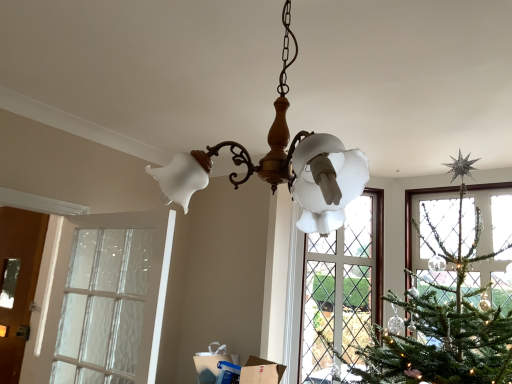
Question: Is matte white glass chandelier at center beside brown wooden door at left?

Choices:
 (A) no
 (B) yes

Answer: (A)

Question: Is the depth of matte white glass chandelier at center greater than that of brown wooden door at left?

Choices:
 (A) yes
 (B) no

Answer: (B)

Question: Considering the relative positions of matte white glass chandelier at center and brown wooden door at left in the image provided, is matte white glass chandelier at center to the left of brown wooden door at left from the viewer's perspective?

Choices:
 (A) yes
 (B) no

Answer: (B)

Question: From the image's perspective, would you say matte white glass chandelier at center is shown under brown wooden door at left?

Choices:
 (A) no
 (B) yes

Answer: (A)

Question: From the image's perspective, does matte white glass chandelier at center appear higher than brown wooden door at left?

Choices:
 (A) yes
 (B) no

Answer: (A)

Question: From a real-world perspective, is matte white glass chandelier at center physically above brown wooden door at left?

Choices:
 (A) yes
 (B) no

Answer: (A)

Question: Does clear glass door at left lie in front of brown wooden door at left?

Choices:
 (A) no
 (B) yes

Answer: (B)

Question: Is brown wooden door at left at the back of clear glass door at left?

Choices:
 (A) yes
 (B) no

Answer: (B)

Question: Does clear glass door at left have a lesser height compared to brown wooden door at left?

Choices:
 (A) yes
 (B) no

Answer: (A)

Question: Can you confirm if clear glass door at left is thinner than brown wooden door at left?

Choices:
 (A) yes
 (B) no

Answer: (B)

Question: Does clear glass door at left turn towards brown wooden door at left?

Choices:
 (A) no
 (B) yes

Answer: (A)

Question: Does clear glass door at left have a smaller size compared to brown wooden door at left?

Choices:
 (A) no
 (B) yes

Answer: (A)

Question: Does clear glass door at left have a smaller size compared to matte white glass chandelier at center?

Choices:
 (A) yes
 (B) no

Answer: (A)